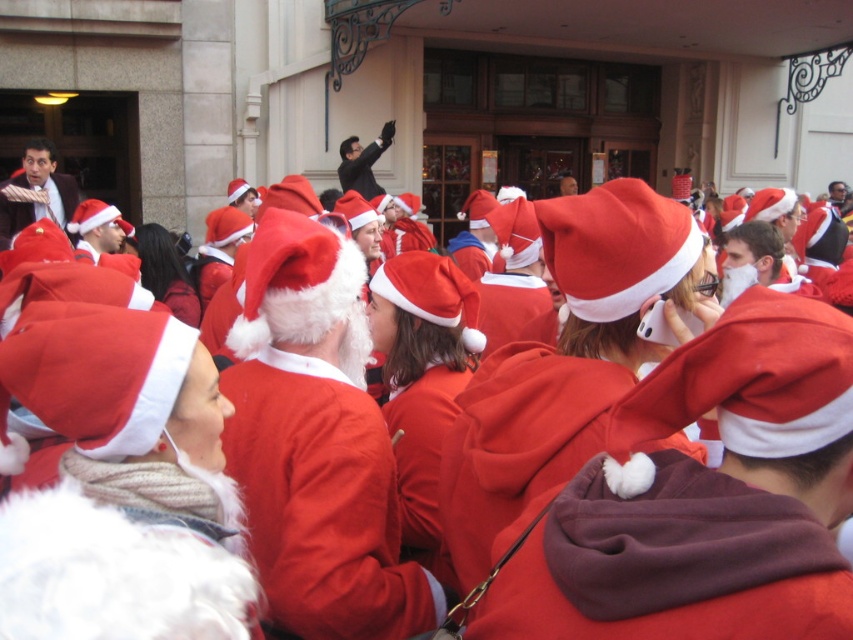
You are organizing a costume party and need to decide which Santa suit to use for a photo shoot. You have two options available in the image, the matte black suit at upper left and the smooth black suit at upper center. Based on their sizes, which one would be more suitable for a larger group photo where visibility is important?

The matte black suit at upper left is larger in size than the smooth black suit at upper center, so it would be more suitable for a larger group photo where visibility is important.

You are organizing a photo shoot for a fashion magazine and need to position two models wearing the matte black suit at upper left and the smooth black suit at upper center. The camera is set up 5 meters away from the models. Can you place them so that both are fully visible in the frame without overlapping?

The matte black suit at upper left and smooth black suit at upper center are 4.47 meters apart. Since the camera is 5 meters away, the distance between them is less than the camera distance, so they can be positioned to be fully visible without overlapping.

You are a photographer positioned in front of the beige building. You notice the matte black suit at upper left and the smooth black suit at upper center. Which Santa costume is positioned lower in the image?

The matte black suit at upper left is located below the smooth black suit at upper center, so it is positioned lower in the image.